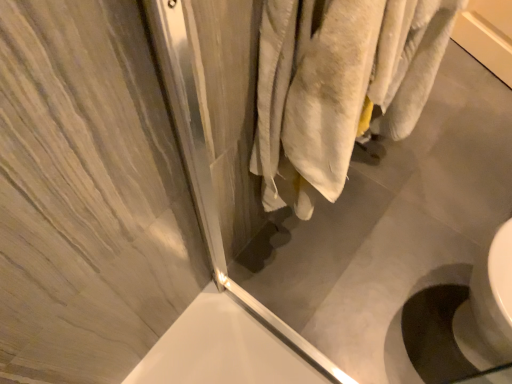
Describe the element at coordinates (464, 320) in the screenshot. I see `white glossy sink at lower right` at that location.

The width and height of the screenshot is (512, 384). Find the location of `white glossy sink at lower right`. white glossy sink at lower right is located at coordinates (464, 320).

Find the location of a particular element. The height and width of the screenshot is (384, 512). translucent glass screen door at upper right is located at coordinates (344, 180).

Describe the element at coordinates (344, 180) in the screenshot. The image size is (512, 384). I see `translucent glass screen door at upper right` at that location.

This screenshot has width=512, height=384. Identify the location of white glossy sink at lower right. (464, 320).

Which object is positioned more to the left, white glossy sink at lower right or translucent glass screen door at upper right?

From the viewer's perspective, translucent glass screen door at upper right appears more on the left side.

In the image, is white glossy sink at lower right positioned in front of or behind translucent glass screen door at upper right?

white glossy sink at lower right is positioned farther from the viewer than translucent glass screen door at upper right.

Does point (448, 298) come behind point (475, 97)?

No.

From the image's perspective, which is above, white glossy sink at lower right or translucent glass screen door at upper right?

translucent glass screen door at upper right, from the image's perspective.

From a real-world perspective, relative to translucent glass screen door at upper right, is white glossy sink at lower right vertically above or below?

white glossy sink at lower right is below translucent glass screen door at upper right.

In terms of width, does white glossy sink at lower right look wider or thinner when compared to translucent glass screen door at upper right?

Considering their sizes, white glossy sink at lower right looks broader than translucent glass screen door at upper right.

Between white glossy sink at lower right and translucent glass screen door at upper right, which one has less height?

white glossy sink at lower right.

Considering the relative sizes of white glossy sink at lower right and translucent glass screen door at upper right in the image provided, is white glossy sink at lower right bigger than translucent glass screen door at upper right?

Indeed, white glossy sink at lower right has a larger size compared to translucent glass screen door at upper right.

Is translucent glass screen door at upper right completely or partially inside white glossy sink at lower right?

No.

Are white glossy sink at lower right and translucent glass screen door at upper right beside each other?

No.

Is white glossy sink at lower right oriented away from translucent glass screen door at upper right?

No, white glossy sink at lower right's orientation is not away from translucent glass screen door at upper right.

How different are the orientations of white glossy sink at lower right and translucent glass screen door at upper right in degrees?

There is a 91.1-degree angle between the facing directions of white glossy sink at lower right and translucent glass screen door at upper right.

You are a GUI agent. You are given a task and a screenshot of the screen. Output one action in this format:
    pyautogui.click(x=<x>, y=<y>)
    Task: Click on the sink behind the translucent glass screen door at upper right
    The image size is (512, 384).
    Given the screenshot: What is the action you would take?
    pyautogui.click(x=464, y=320)

Between translucent glass screen door at upper right and white glossy sink at lower right, which one appears on the right side from the viewer's perspective?

From the viewer's perspective, white glossy sink at lower right appears more on the right side.

Between translucent glass screen door at upper right and white glossy sink at lower right, which one is positioned in front?

translucent glass screen door at upper right is more forward.

Which point is more distant from viewer, (234, 235) or (436, 326)?

The point (436, 326) is farther from the camera.

From the image's perspective, is translucent glass screen door at upper right below white glossy sink at lower right?

No, from the image's perspective, translucent glass screen door at upper right is not below white glossy sink at lower right.

From a real-world perspective, between translucent glass screen door at upper right and white glossy sink at lower right, who is vertically lower?

white glossy sink at lower right is physically lower.

Considering the sizes of translucent glass screen door at upper right and white glossy sink at lower right in the image, is translucent glass screen door at upper right wider or thinner than white glossy sink at lower right?

Clearly, translucent glass screen door at upper right has less width compared to white glossy sink at lower right.

Is translucent glass screen door at upper right taller than white glossy sink at lower right?

Indeed, translucent glass screen door at upper right has a greater height compared to white glossy sink at lower right.

Who is smaller, translucent glass screen door at upper right or white glossy sink at lower right?

translucent glass screen door at upper right.

Is white glossy sink at lower right a part of translucent glass screen door at upper right?

No, white glossy sink at lower right is not a part of translucent glass screen door at upper right.

Are translucent glass screen door at upper right and white glossy sink at lower right making contact?

No, translucent glass screen door at upper right is not beside white glossy sink at lower right.

Is translucent glass screen door at upper right facing away from white glossy sink at lower right?

That's not correct — translucent glass screen door at upper right is not looking away from white glossy sink at lower right.

How distant is translucent glass screen door at upper right from white glossy sink at lower right?

translucent glass screen door at upper right and white glossy sink at lower right are 11.18 inches apart from each other.

Locate an element on the screen. The height and width of the screenshot is (384, 512). screen door above the white glossy sink at lower right (from a real-world perspective) is located at coordinates (344, 180).

Where is `screen door on the left of white glossy sink at lower right`? This screenshot has height=384, width=512. screen door on the left of white glossy sink at lower right is located at coordinates (344, 180).

There is a white glossy sink at lower right. Find the location of `screen door above it (from a real-world perspective)`. screen door above it (from a real-world perspective) is located at coordinates (344, 180).